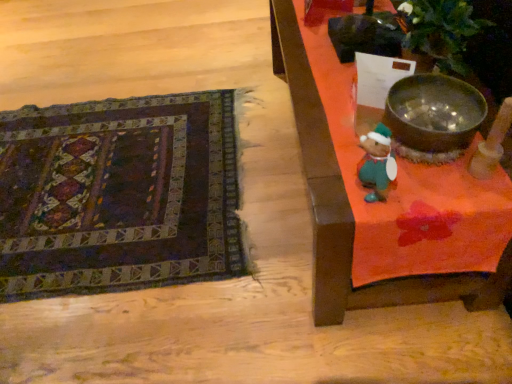
Question: Can you confirm if dark woven rug at lower left is shorter than shiny metallic bowl at upper right?

Choices:
 (A) no
 (B) yes

Answer: (B)

Question: Does dark woven rug at lower left have a lesser width compared to shiny metallic bowl at upper right?

Choices:
 (A) no
 (B) yes

Answer: (A)

Question: From the image's perspective, is dark woven rug at lower left located above shiny metallic bowl at upper right?

Choices:
 (A) no
 (B) yes

Answer: (A)

Question: Is dark woven rug at lower left wider than shiny metallic bowl at upper right?

Choices:
 (A) no
 (B) yes

Answer: (B)

Question: Is dark woven rug at lower left further to camera compared to shiny metallic bowl at upper right?

Choices:
 (A) no
 (B) yes

Answer: (B)

Question: From a real-world perspective, is dark woven rug at lower left positioned under shiny metallic bowl at upper right based on gravity?

Choices:
 (A) yes
 (B) no

Answer: (A)

Question: From the image's perspective, is dark woven rug at lower left above wooden table at right?

Choices:
 (A) yes
 (B) no

Answer: (B)

Question: Considering the relative positions of dark woven rug at lower left and wooden table at right in the image provided, is dark woven rug at lower left in front of wooden table at right?

Choices:
 (A) yes
 (B) no

Answer: (B)

Question: Does dark woven rug at lower left have a lesser height compared to wooden table at right?

Choices:
 (A) no
 (B) yes

Answer: (B)

Question: Is dark woven rug at lower left beside wooden table at right?

Choices:
 (A) yes
 (B) no

Answer: (B)

Question: From the image's perspective, does dark woven rug at lower left appear lower than wooden table at right?

Choices:
 (A) yes
 (B) no

Answer: (A)

Question: Is wooden table at right at the back of dark woven rug at lower left?

Choices:
 (A) no
 (B) yes

Answer: (A)

Question: Can you confirm if wooden table at right is wider than dark woven rug at lower left?

Choices:
 (A) no
 (B) yes

Answer: (A)